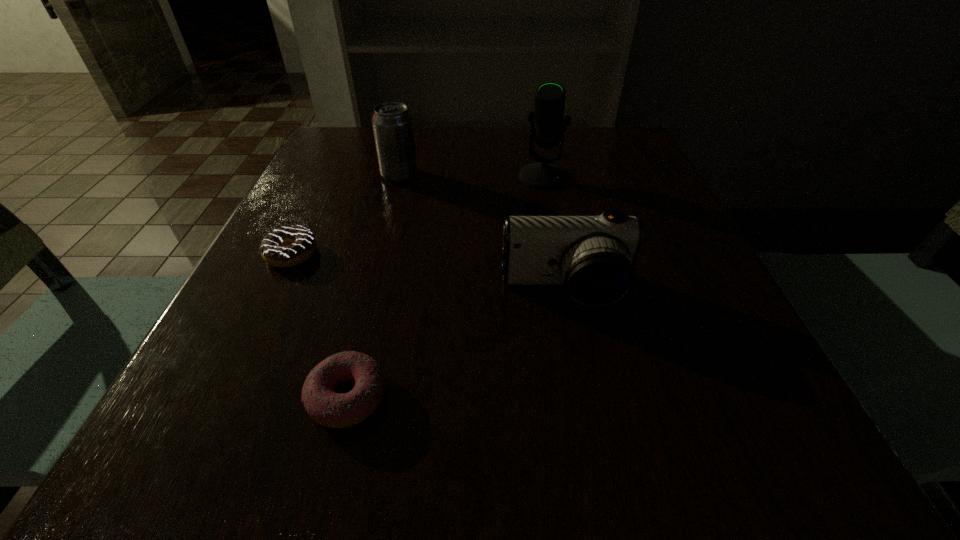
Locate an element on the screen. The height and width of the screenshot is (540, 960). the tallest object is located at coordinates (547, 118).

You are a GUI agent. You are given a task and a screenshot of the screen. Output one action in this format:
    pyautogui.click(x=<x>, y=<y>)
    Task: Click on the soda can
    The image size is (960, 540).
    Given the screenshot: What is the action you would take?
    pyautogui.click(x=392, y=123)

The height and width of the screenshot is (540, 960). Find the location of `camcorder`. camcorder is located at coordinates (593, 257).

You are a GUI agent. You are given a task and a screenshot of the screen. Output one action in this format:
    pyautogui.click(x=<x>, y=<y>)
    Task: Click on the right doughnut
    Image resolution: width=960 pixels, height=540 pixels.
    Given the screenshot: What is the action you would take?
    pyautogui.click(x=335, y=410)

Where is `the nearest object`? the nearest object is located at coordinates (335, 410).

Where is `the farther doughnut`? This screenshot has height=540, width=960. the farther doughnut is located at coordinates (287, 246).

Find the location of `the shortest object`. the shortest object is located at coordinates coord(287,246).

At what (x,y) coordinates should I click in order to perform the action: click on free space located 0.290m on the front of the tallest object. Please return your answer as a coordinate pair (x, y). Looking at the image, I should click on (564, 284).

The width and height of the screenshot is (960, 540). In order to click on vacant area located on the back of the soda can in this screenshot , I will do `click(410, 133)`.

You are a GUI agent. You are given a task and a screenshot of the screen. Output one action in this format:
    pyautogui.click(x=<x>, y=<y>)
    Task: Click on the vacant region located 0.210m on the surface of the camcorder
    
    Given the screenshot: What is the action you would take?
    pyautogui.click(x=595, y=448)